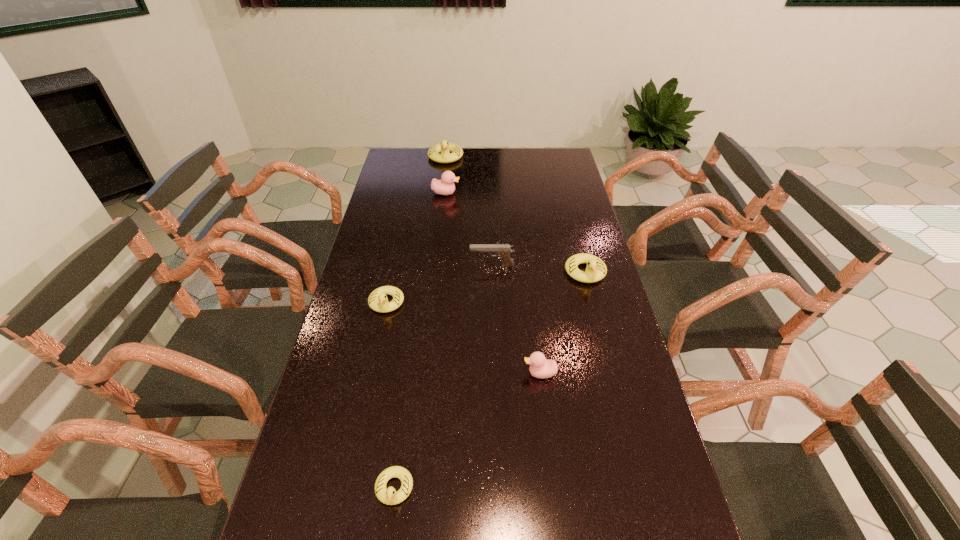
You are a GUI agent. You are given a task and a screenshot of the screen. Output one action in this format:
    pyautogui.click(x=<x>, y=<y>)
    Task: Click on the free space at the far left corner of the desktop
    The image size is (960, 540).
    Given the screenshot: What is the action you would take?
    pyautogui.click(x=403, y=171)

Identify the location of free space at the far right corner of the desktop. (562, 153).

Image resolution: width=960 pixels, height=540 pixels. I want to click on vacant point located between the second nearest object and the rightmost duckling, so click(563, 323).

At what (x,y) coordinates should I click in order to perform the action: click on blank region between the nearest duckling and the third nearest yellow duckling. Please return your answer as a coordinate pair (x, y). Image resolution: width=960 pixels, height=540 pixels. Looking at the image, I should click on (490, 380).

At what (x,y) coordinates should I click in order to perform the action: click on free space between the right pink duckling and the farthest yellow duckling. Please return your answer as a coordinate pair (x, y). This screenshot has height=540, width=960. Looking at the image, I should click on (492, 265).

Identify the location of vacant region between the right pink duckling and the nearest duckling. This screenshot has height=540, width=960. (468, 431).

This screenshot has width=960, height=540. What are the coordinates of `vacant area between the bigger pink duckling and the pistol` in the screenshot? It's located at (468, 230).

Where is `object that is the fifth closest to the second farthest object`? The width and height of the screenshot is (960, 540). object that is the fifth closest to the second farthest object is located at coordinates (540, 367).

Point out which object is positioned as the third nearest to the farthest object. Please provide its 2D coordinates. Your answer should be formatted as a tuple, i.e. [(x, y)], where the tuple contains the x and y coordinates of a point satisfying the conditions above.

[(596, 269)]

I want to click on duckling that is the fifth closest to the farthest yellow duckling, so click(x=389, y=496).